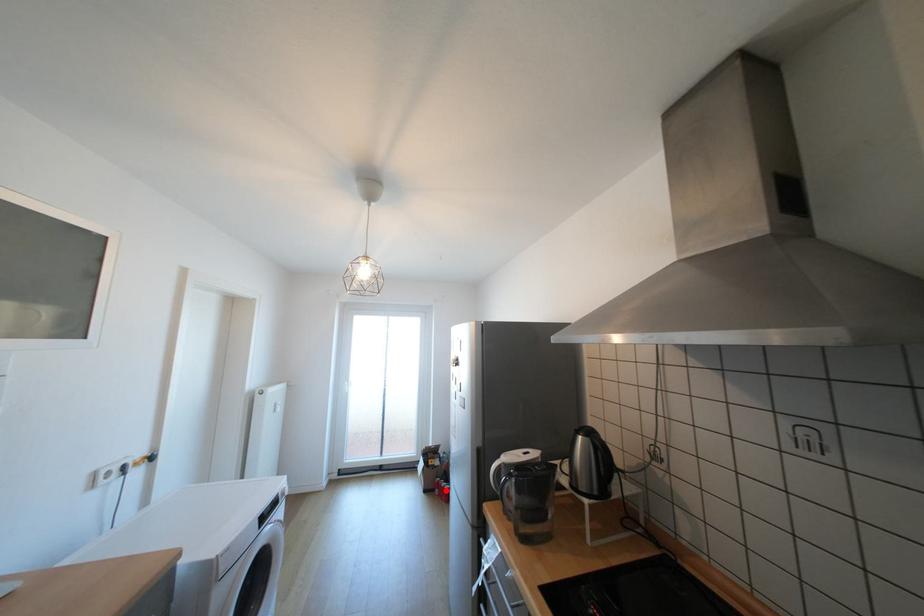
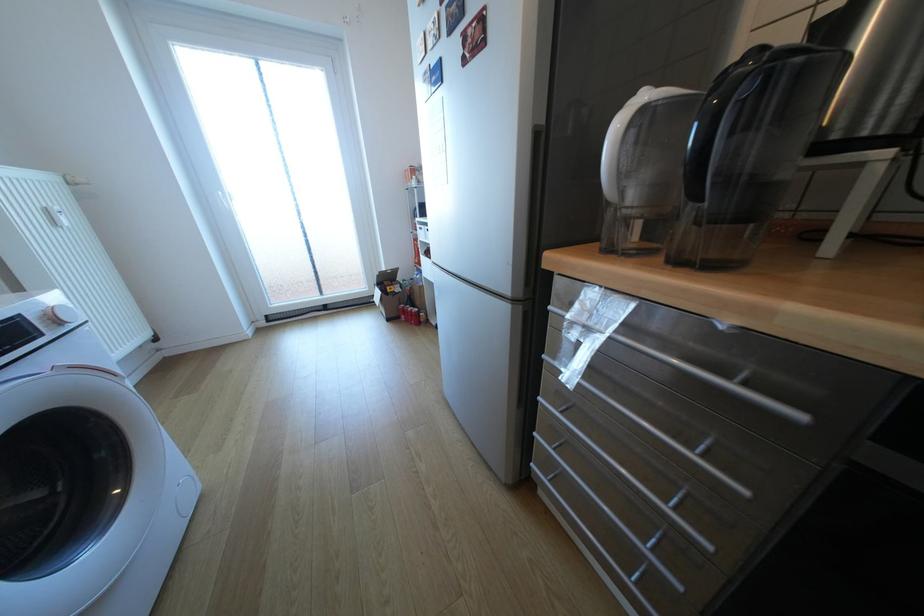
In the second image, find the point that corresponds to the highlighted location in the first image.

(411, 315)